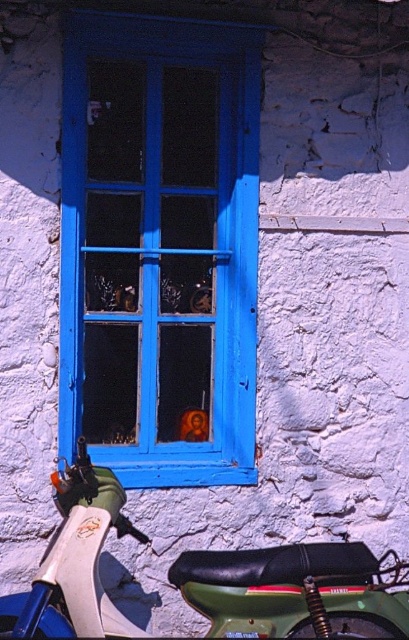
Question: Among these points, which one is nearest to the camera?

Choices:
 (A) (226, 433)
 (B) (94, 588)

Answer: (B)

Question: Is blue painted wood at center behind green matte motorcycle at lower left?

Choices:
 (A) no
 (B) yes

Answer: (B)

Question: Does blue painted wood at center appear under green matte motorcycle at lower left?

Choices:
 (A) no
 (B) yes

Answer: (A)

Question: Is blue painted wood at center smaller than green matte motorcycle at lower left?

Choices:
 (A) yes
 (B) no

Answer: (B)